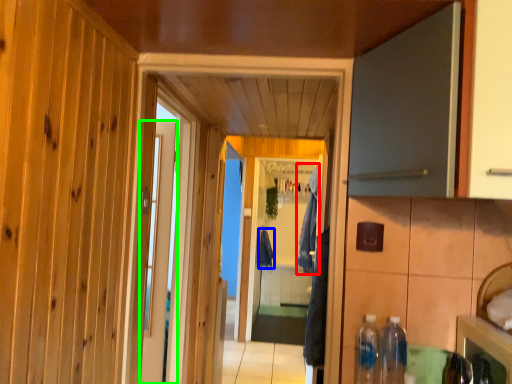
Question: Estimate the real-world distances between objects in this image. Which object is closer to laundry (highlighted by a red box), laundry (highlighted by a blue box) or door (highlighted by a green box)?

Choices:
 (A) laundry
 (B) door

Answer: (A)